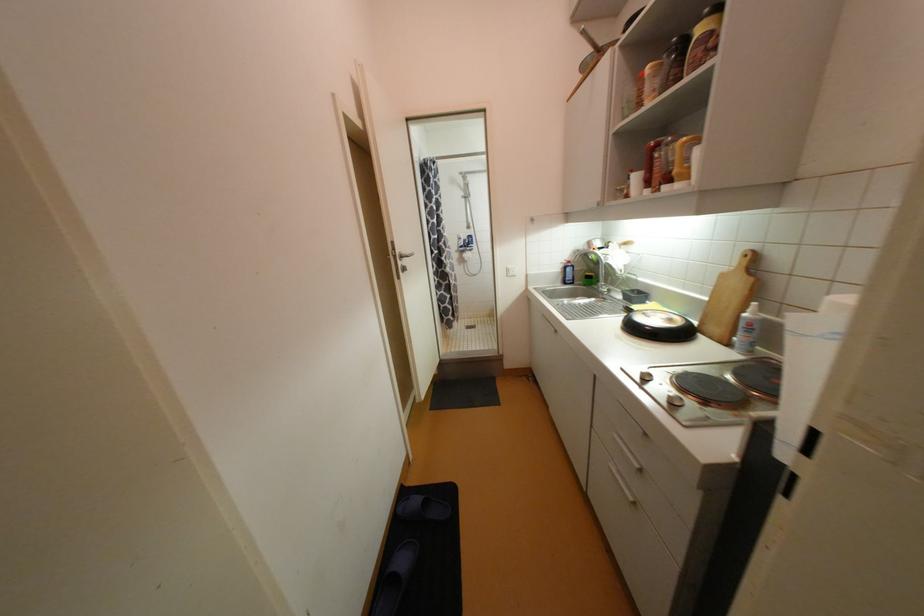
The image size is (924, 616). Find the location of `white light switch`. white light switch is located at coordinates (511, 270).